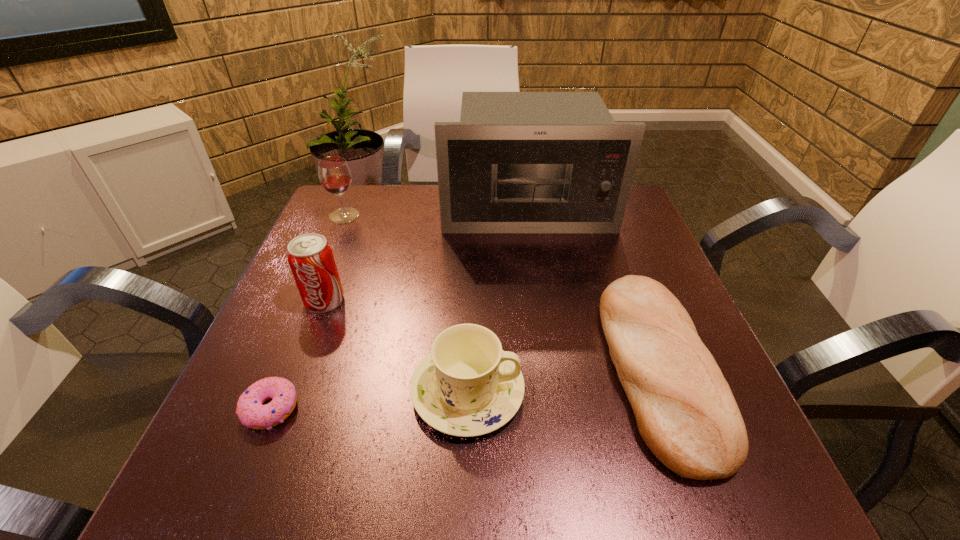
Where is `bread located at the right edge`? The image size is (960, 540). bread located at the right edge is located at coordinates (685, 411).

At what (x,y) coordinates should I click in order to perform the action: click on object that is at the far left corner. Please return your answer as a coordinate pair (x, y). This screenshot has height=540, width=960. Looking at the image, I should click on (334, 173).

Where is `object that is positioned at the far right corner`? object that is positioned at the far right corner is located at coordinates (517, 162).

Identify the location of object that is at the near right corner. Image resolution: width=960 pixels, height=540 pixels. (685, 411).

The image size is (960, 540). In the image, there is a desktop. What are the coordinates of `vacant space at the far edge` in the screenshot? It's located at (390, 215).

You are a GUI agent. You are given a task and a screenshot of the screen. Output one action in this format:
    pyautogui.click(x=<x>, y=<y>)
    Task: Click on the vacant space at the left edge of the desktop
    Image resolution: width=960 pixels, height=540 pixels.
    Given the screenshot: What is the action you would take?
    pyautogui.click(x=308, y=336)

Where is `vacant point at the right edge`? The width and height of the screenshot is (960, 540). vacant point at the right edge is located at coordinates (667, 267).

Find the location of a particular element. The image size is (960, 540). vacant space at the far left corner is located at coordinates [372, 207].

Locate an element on the screen. This screenshot has width=960, height=540. free location at the near left corner is located at coordinates (275, 470).

Where is `vacant space at the near right corner of the desktop`? vacant space at the near right corner of the desktop is located at coordinates (747, 475).